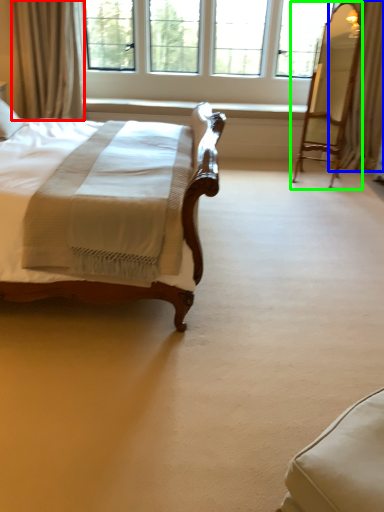
Question: Which is farther away from curtain (highlighted by a red box)? curtain (highlighted by a blue box) or swivel chair (highlighted by a green box)?

Choices:
 (A) curtain
 (B) swivel chair

Answer: (A)